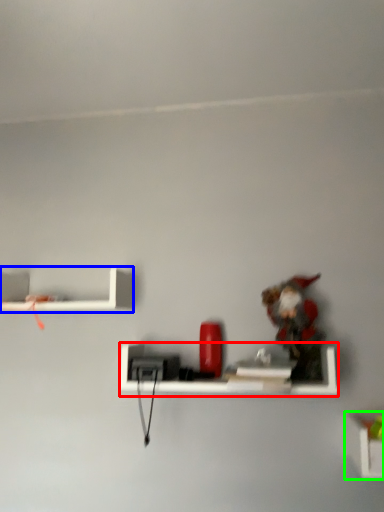
Question: Considering the real-world distances, which object is closest to shelf (highlighted by a red box)? shelf (highlighted by a blue box) or shelf (highlighted by a green box).

Choices:
 (A) shelf
 (B) shelf

Answer: (B)